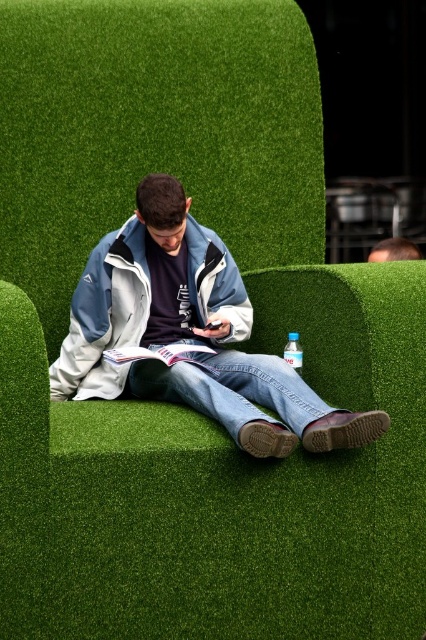
You are a photographer setting up a shoot in this scene. You need to position a light source so that it illuminates the light blue jacket at center without casting a shadow from the smooth brown hair at upper right. Where should you place the light relative to the person?

The light blue jacket at center is below the smooth brown hair at upper right. To avoid casting a shadow from the hair onto the jacket, the light source should be placed above the person, positioned so that it shines downward from a direction that keeps the hair from blocking the light onto the jacket.

You are a photographer setting up a shoot in this scene. You need to position a light source to the right of the smooth brown hair at upper right. Will the light source block the view of the light blue fleece jacket at center?

The light blue fleece jacket at center is to the left of the smooth brown hair at upper right. Positioning the light source to the right of the smooth brown hair at upper right would place it away from the jacket, so the light source will not block the view of the light blue fleece jacket at center.

You are trying to place a small decorative item between the striped fabric book at center and the smooth brown hair at upper right. Considering their sizes, can you fit it there?

The striped fabric book at center might be wider than smooth brown hair at upper right, so there may not be enough space to fit a small decorative item between them.